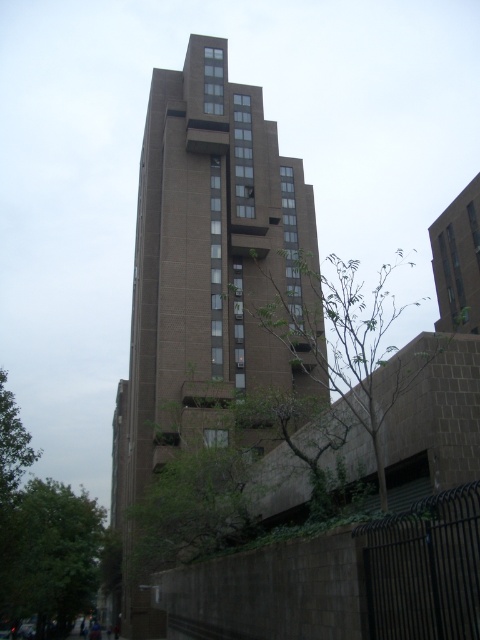
Question: Estimate the real-world distances between objects in this image. Which object is closer to the brown concrete building at center?

Choices:
 (A) green leafy tree at lower left
 (B) green leafy tree at center

Answer: (B)

Question: Can you confirm if brown concrete building at center is thinner than green leafy tree at lower left?

Choices:
 (A) no
 (B) yes

Answer: (A)

Question: Which object appears closest to the camera in this image?

Choices:
 (A) green leafy tree at center
 (B) brown concrete building at center
 (C) green leafy tree at lower left

Answer: (A)

Question: Can you confirm if green leafy tree at center is positioned above green leafy tree at lower left?

Choices:
 (A) yes
 (B) no

Answer: (A)

Question: Which object is the closest to the green leafy tree at lower left?

Choices:
 (A) brown concrete building at center
 (B) green leafy tree at center

Answer: (A)

Question: Is green leafy tree at center to the left of green leafy tree at lower left from the viewer's perspective?

Choices:
 (A) yes
 (B) no

Answer: (B)